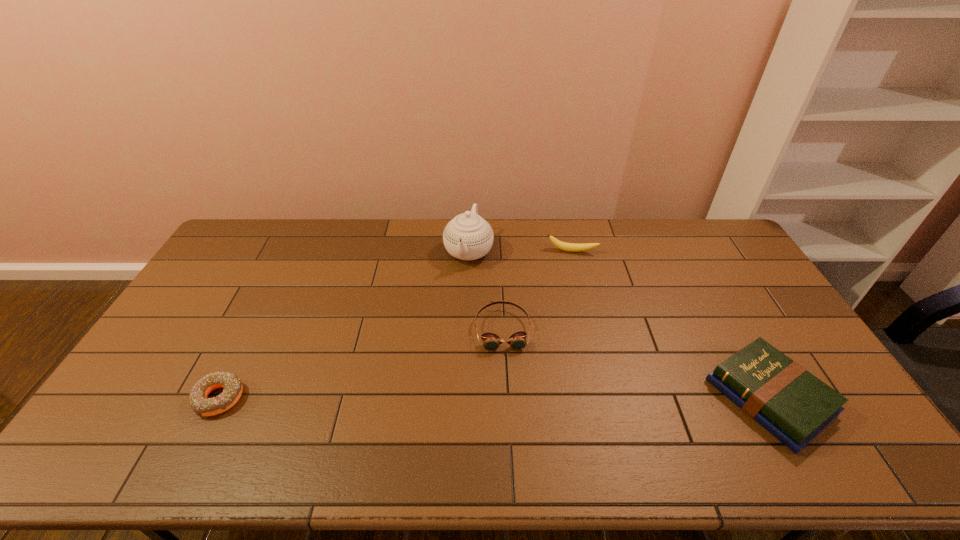
This screenshot has width=960, height=540. What are the coordinates of `vacant space that satisfies the following two spatial constraints: 1. on the front side of the tallest object; 2. on the right side of the book` in the screenshot? It's located at (465, 397).